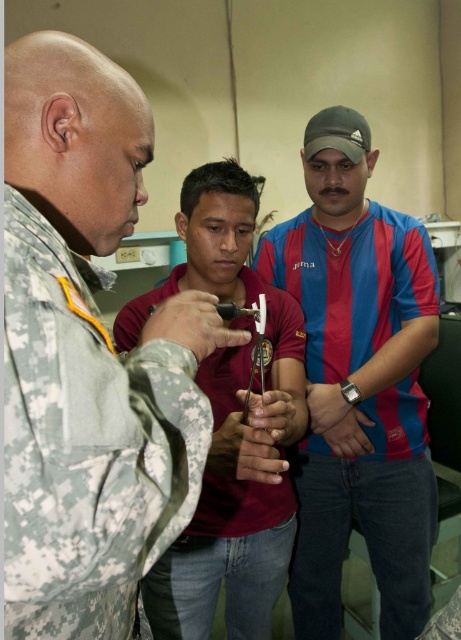
Question: Which is nearer to the blue striped shirt at center?

Choices:
 (A) camouflage fabric uniform at center
 (B) camouflage fabric uniform at left

Answer: (A)

Question: Does blue striped shirt at center appear under camouflage fabric uniform at center?

Choices:
 (A) no
 (B) yes

Answer: (A)

Question: Is camouflage fabric uniform at left to the right of blue striped shirt at center from the viewer's perspective?

Choices:
 (A) no
 (B) yes

Answer: (A)

Question: Which is nearer to the camouflage fabric uniform at left?

Choices:
 (A) camouflage fabric uniform at center
 (B) blue striped shirt at center

Answer: (A)

Question: Which object is the closest to the blue striped shirt at center?

Choices:
 (A) camouflage fabric uniform at center
 (B) camouflage fabric uniform at left

Answer: (A)

Question: Is camouflage fabric uniform at left thinner than blue striped shirt at center?

Choices:
 (A) no
 (B) yes

Answer: (B)